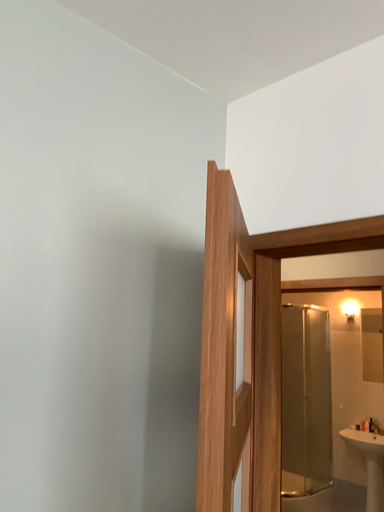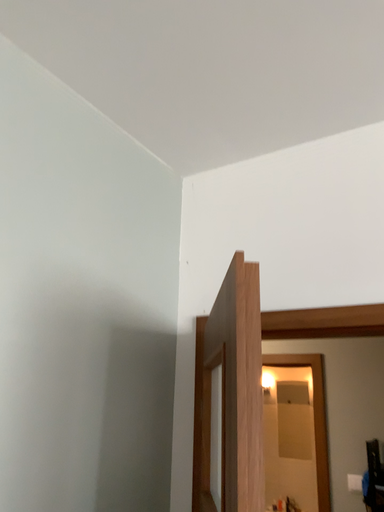
Question: How did the camera likely rotate when shooting the video?

Choices:
 (A) rotated downward
 (B) rotated upward

Answer: (B)